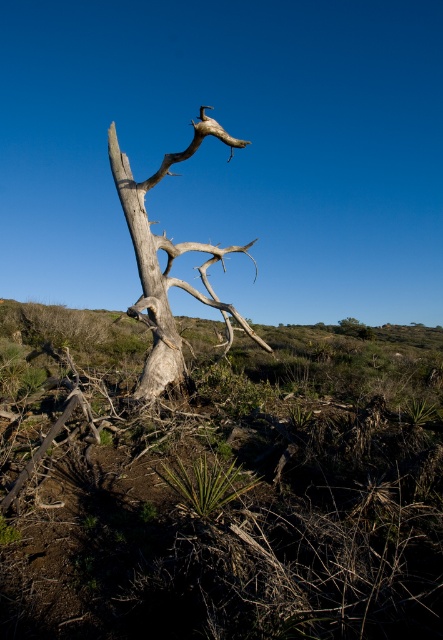
Who is higher up, gray textured tree trunk at center or gray rough bark tree trunk at center?

gray textured tree trunk at center is above.

Between point (175, 337) and point (190, 147), which one is positioned behind?

The point (175, 337) is behind.

At what (x,y) coordinates should I click in order to perform the action: click on gray textured tree trunk at center. Please return your answer as a coordinate pair (x, y). Looking at the image, I should click on (167, 260).